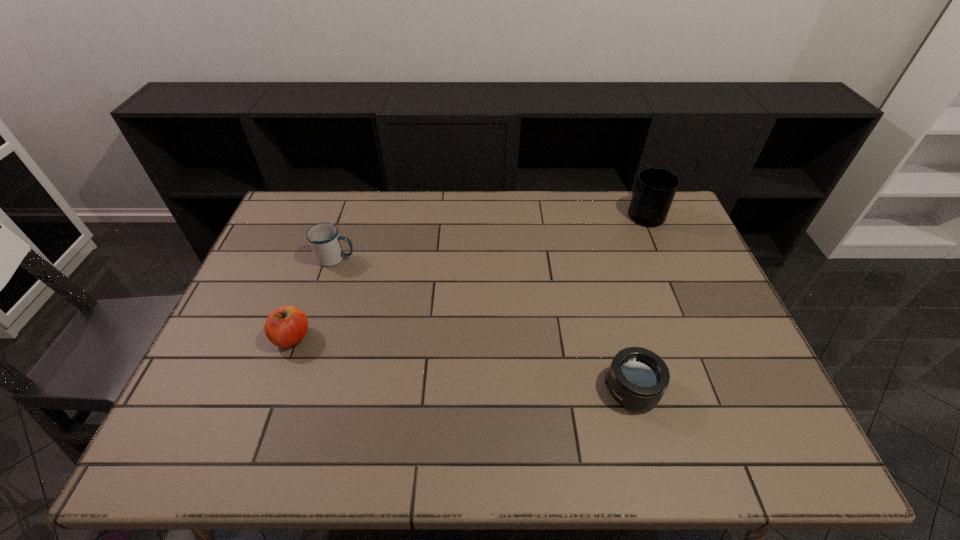
This screenshot has width=960, height=540. I want to click on free spot between the nearer mug and the telephoto lens, so click(x=484, y=324).

I want to click on empty location between the left mug and the apple, so click(314, 298).

The width and height of the screenshot is (960, 540). I want to click on object that is the second closest to the third farthest object, so (637, 379).

What are the coordinates of `object that is the second closest to the nearest object` in the screenshot? It's located at 286,326.

Where is `vacant area that satisfies the following two spatial constraints: 1. on the handle side of the shorter mug; 2. on the front side of the apple`? The width and height of the screenshot is (960, 540). vacant area that satisfies the following two spatial constraints: 1. on the handle side of the shorter mug; 2. on the front side of the apple is located at coordinates (310, 338).

Locate an element on the screen. This screenshot has height=540, width=960. vacant position in the image that satisfies the following two spatial constraints: 1. on the handle side of the left mug; 2. on the front side of the third farthest object is located at coordinates (310, 338).